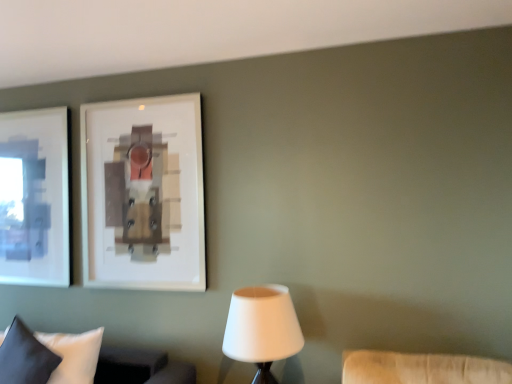
Question: From the image's perspective, is dark blue fabric pillow at lower left on top of white matte lampshade at lower center?

Choices:
 (A) no
 (B) yes

Answer: (A)

Question: Does dark blue fabric pillow at lower left contain white matte lampshade at lower center?

Choices:
 (A) no
 (B) yes

Answer: (A)

Question: Can you confirm if dark blue fabric pillow at lower left is shorter than white matte lampshade at lower center?

Choices:
 (A) yes
 (B) no

Answer: (A)

Question: From the image's perspective, is dark blue fabric pillow at lower left under white matte lampshade at lower center?

Choices:
 (A) no
 (B) yes

Answer: (B)

Question: Can you confirm if dark blue fabric pillow at lower left is thinner than white matte lampshade at lower center?

Choices:
 (A) no
 (B) yes

Answer: (B)

Question: In the image, is white fabric pillow at lower left positioned in front of or behind white matte lampshade at lower center?

Choices:
 (A) behind
 (B) front

Answer: (A)

Question: From a real-world perspective, is white fabric pillow at lower left above or below white matte lampshade at lower center?

Choices:
 (A) above
 (B) below

Answer: (B)

Question: Does point (178, 369) appear closer or farther from the camera than point (287, 317)?

Choices:
 (A) farther
 (B) closer

Answer: (A)

Question: In the image, is white fabric pillow at lower left on the left side or the right side of white matte lampshade at lower center?

Choices:
 (A) left
 (B) right

Answer: (A)

Question: Considering the positions of dark blue fabric pillow at lower left and white fabric pillow at lower left in the image, is dark blue fabric pillow at lower left taller or shorter than white fabric pillow at lower left?

Choices:
 (A) tall
 (B) short

Answer: (A)

Question: In the image, is dark blue fabric pillow at lower left on the left side or the right side of white fabric pillow at lower left?

Choices:
 (A) left
 (B) right

Answer: (A)

Question: From the image's perspective, is dark blue fabric pillow at lower left positioned above or below white fabric pillow at lower left?

Choices:
 (A) below
 (B) above

Answer: (B)

Question: Considering the positions of point pos(29,380) and point pos(25,382), is point pos(29,380) closer or farther from the camera than point pos(25,382)?

Choices:
 (A) farther
 (B) closer

Answer: (A)

Question: From their relative heights in the image, would you say dark blue fabric pillow at lower left is taller or shorter than white matte lampshade at lower center?

Choices:
 (A) short
 (B) tall

Answer: (A)

Question: Does point (1, 370) appear closer or farther from the camera than point (287, 312)?

Choices:
 (A) closer
 (B) farther

Answer: (B)